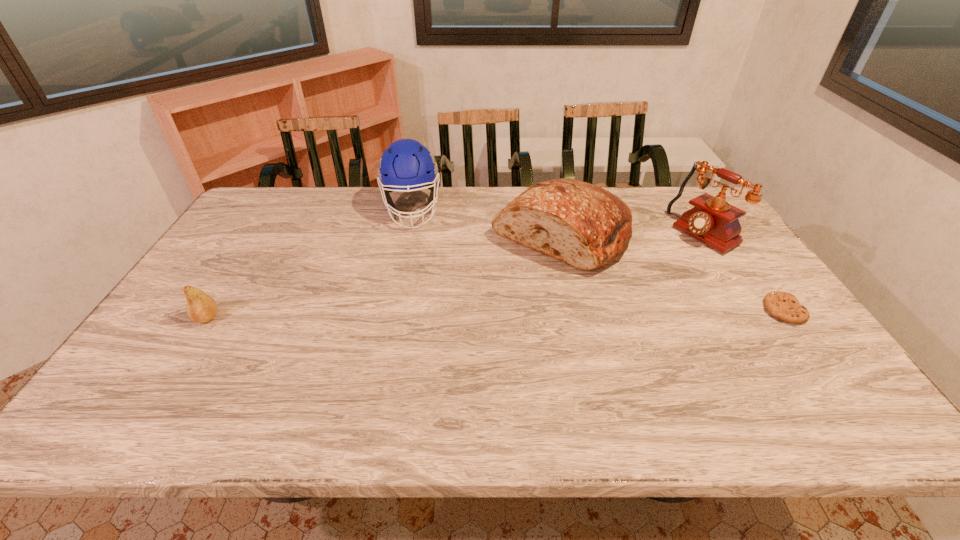
The image size is (960, 540). What are the coordinates of `telephone that is at the far edge` in the screenshot? It's located at (713, 221).

Image resolution: width=960 pixels, height=540 pixels. In order to click on object positioned at the left edge in this screenshot , I will do `click(201, 308)`.

In order to click on cookie positioned at the right edge in this screenshot , I will do `click(782, 305)`.

Identify the location of telephone located at the right edge. The image size is (960, 540). (713, 221).

Locate an element on the screen. This screenshot has width=960, height=540. object present at the far right corner is located at coordinates (713, 221).

Where is `free region at the far edge of the desktop`? Image resolution: width=960 pixels, height=540 pixels. free region at the far edge of the desktop is located at coordinates (422, 207).

In the image, there is a desktop. Where is `vacant space at the near edge`? The width and height of the screenshot is (960, 540). vacant space at the near edge is located at coordinates (332, 361).

Locate an element on the screen. The image size is (960, 540). vacant space at the right edge is located at coordinates (685, 237).

In the image, there is a desktop. Where is `vacant space at the near left corner`? vacant space at the near left corner is located at coordinates (174, 376).

Where is `blank region between the telephone and the leftmost object`? The width and height of the screenshot is (960, 540). blank region between the telephone and the leftmost object is located at coordinates (455, 275).